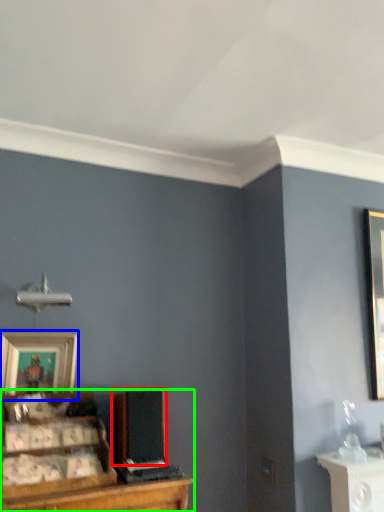
Question: Considering the real-world distances, which object is closest to speaker (highlighted by a red box)? picture frame (highlighted by a blue box) or entertainment center (highlighted by a green box).

Choices:
 (A) picture frame
 (B) entertainment center

Answer: (B)